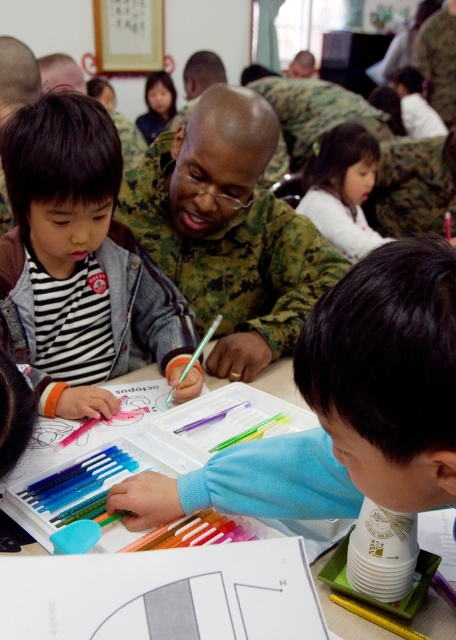
Between smooth blue sweater at lower right and camouflage uniform at center, which one is positioned lower?

smooth blue sweater at lower right is below.

Is point (345, 493) farther from camera compared to point (123, 180)?

No, it is in front of (123, 180).

The height and width of the screenshot is (640, 456). Identify the location of smooth blue sweater at lower right. (346, 406).

Is point (425, 502) less distant than point (447, 621)?

Yes, it is in front of point (447, 621).

Describe the element at coordinates (346, 406) in the screenshot. This screenshot has height=640, width=456. I see `smooth blue sweater at lower right` at that location.

Between point (217, 490) and point (324, 556), which one is positioned in front?

Point (217, 490)

Where is `smooth blue sweater at lower right`? This screenshot has height=640, width=456. smooth blue sweater at lower right is located at coordinates (346, 406).

Which is above, striped fabric shirt at center or camouflage uniform at center?

Positioned higher is camouflage uniform at center.

Does striped fabric shirt at center appear on the left side of camouflage uniform at center?

Correct, you'll find striped fabric shirt at center to the left of camouflage uniform at center.

Does point (26, 266) come farther from viewer compared to point (273, 202)?

No.

I want to click on striped fabric shirt at center, so click(x=82, y=262).